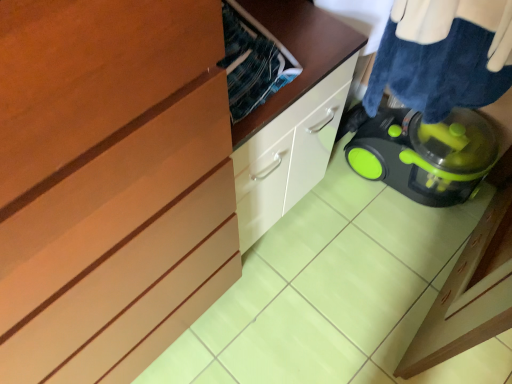
Question: From the image's perspective, is matte wood cabinet at center on top of green plastic laundry basket at lower right?

Choices:
 (A) no
 (B) yes

Answer: (A)

Question: Is the position of matte wood cabinet at center more distant than that of green plastic laundry basket at lower right?

Choices:
 (A) yes
 (B) no

Answer: (A)

Question: Is the depth of matte wood cabinet at center less than that of green plastic laundry basket at lower right?

Choices:
 (A) yes
 (B) no

Answer: (B)

Question: Can you confirm if matte wood cabinet at center is bigger than green plastic laundry basket at lower right?

Choices:
 (A) yes
 (B) no

Answer: (A)

Question: From a real-world perspective, is matte wood cabinet at center below green plastic laundry basket at lower right?

Choices:
 (A) yes
 (B) no

Answer: (A)

Question: Considering the relative sizes of matte wood cabinet at center and green plastic laundry basket at lower right in the image provided, is matte wood cabinet at center thinner than green plastic laundry basket at lower right?

Choices:
 (A) yes
 (B) no

Answer: (B)

Question: Is green plastic laundry basket at lower right oriented away from matte wood cabinet at center?

Choices:
 (A) yes
 (B) no

Answer: (B)

Question: From the image's perspective, does green plastic laundry basket at lower right appear higher than matte wood cabinet at center?

Choices:
 (A) yes
 (B) no

Answer: (A)

Question: Does green plastic laundry basket at lower right appear on the left side of matte wood cabinet at center?

Choices:
 (A) yes
 (B) no

Answer: (B)

Question: Can you confirm if green plastic laundry basket at lower right is positioned to the right of matte wood cabinet at center?

Choices:
 (A) yes
 (B) no

Answer: (A)

Question: Is green plastic laundry basket at lower right further to camera compared to matte wood cabinet at center?

Choices:
 (A) yes
 (B) no

Answer: (B)

Question: Can you see green plastic laundry basket at lower right touching matte wood cabinet at center?

Choices:
 (A) yes
 (B) no

Answer: (B)

Question: Considering the positions of matte wood cabinet at center and green plastic laundry basket at lower right in the image, is matte wood cabinet at center taller or shorter than green plastic laundry basket at lower right?

Choices:
 (A) short
 (B) tall

Answer: (B)